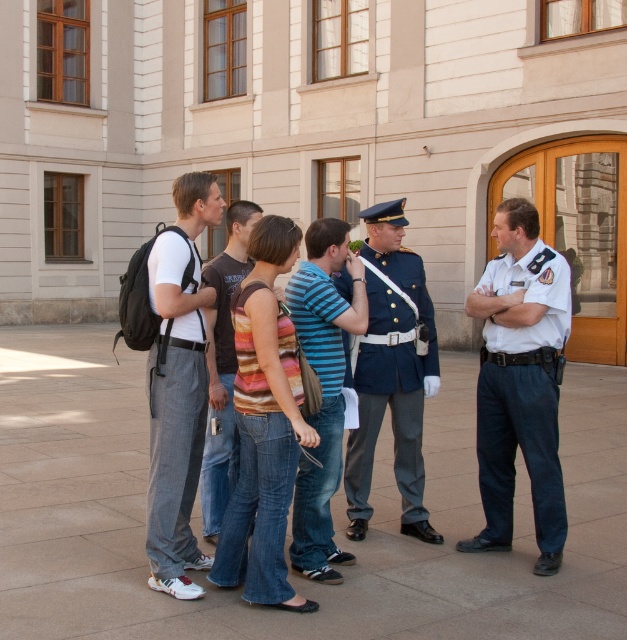
You are a photographer trying to capture a group photo of the striped fabric tank top at center and the striped shirt at center. Based on their heights, which one should you position closer to the front to ensure both are visible in the photo?

The striped fabric tank top at center has a lesser height compared to striped shirt at center, so you should position the striped fabric tank top at center closer to the front to ensure both are visible in the photo.

You are standing at the point labeled point (208,346) and want to walk to the entrance of the building located at point (408,276). Is there a clear path between these two points?

Yes, there is a clear path between point (208,346) and point (408,276) since the description states that point (408,276) is behind point (208,346), implying a direct line of sight or unobstructed path.

You are a photographer trying to capture a clear photo of the blue uniform at center without the striped fabric tank top at center blocking it. What should you do?

Move the camera backward to create more distance between the striped fabric tank top at center and the blue uniform at center, allowing the blue uniform at center to be visible without obstruction.